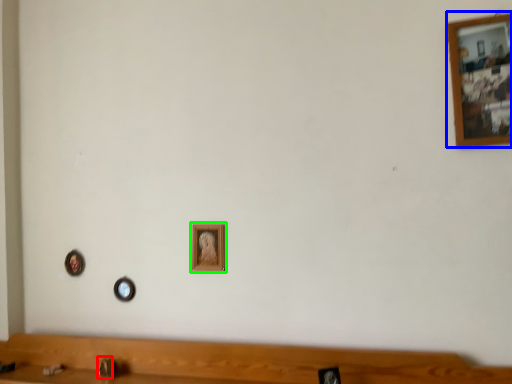
Question: Which object is positioned farthest from faucet (highlighted by a red box)? Select from picture frame (highlighted by a blue box) and picture frame (highlighted by a green box).

Choices:
 (A) picture frame
 (B) picture frame

Answer: (A)